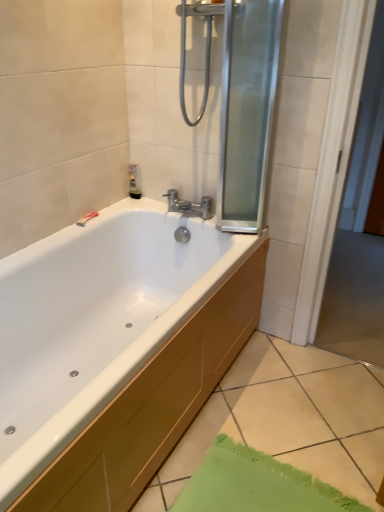
Question: In terms of width, does white glossy bathtub at lower left look wider or thinner when compared to transparent glass screen door at upper right?

Choices:
 (A) thin
 (B) wide

Answer: (B)

Question: Would you say white glossy bathtub at lower left is inside or outside transparent glass screen door at upper right?

Choices:
 (A) inside
 (B) outside

Answer: (B)

Question: Estimate the real-world distances between objects in this image. Which object is farther from the transparent glass screen door at upper right?

Choices:
 (A) translucent plastic tube at upper left
 (B) chrome metallic faucet at center
 (C) white glossy bathtub at lower left

Answer: (A)

Question: Based on their relative distances, which object is farther from the translucent plastic tube at upper left?

Choices:
 (A) white glossy bathtub at lower left
 (B) transparent glass screen door at upper right
 (C) chrome metallic faucet at center

Answer: (A)